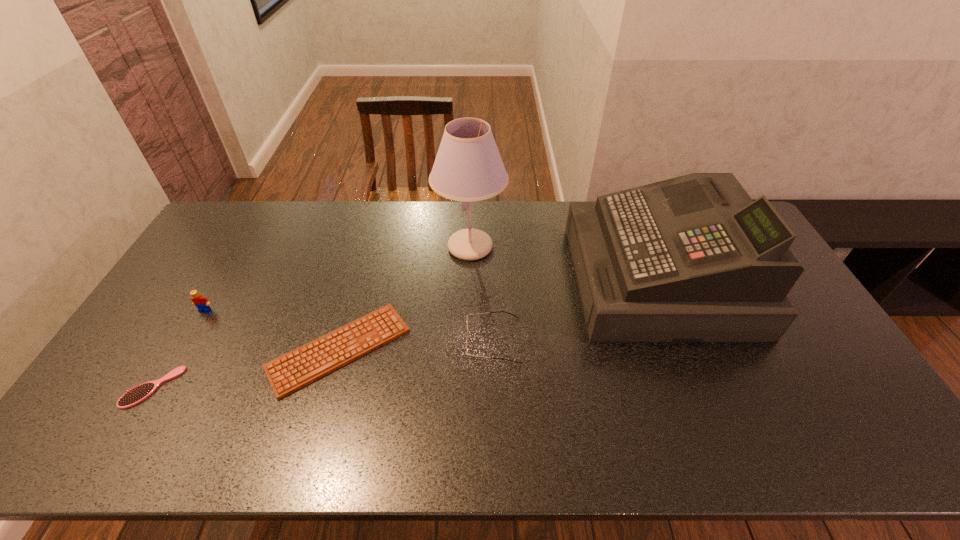
Where is `lampshade`? The height and width of the screenshot is (540, 960). lampshade is located at coordinates (468, 167).

Where is `cash register`? cash register is located at coordinates (690, 259).

At what (x,y) coordinates should I click in order to perform the action: click on the fifth shortest object. Please return your answer as a coordinate pair (x, y). The width and height of the screenshot is (960, 540). Looking at the image, I should click on (690, 259).

You are a GUI agent. You are given a task and a screenshot of the screen. Output one action in this format:
    pyautogui.click(x=<x>, y=<y>)
    Task: Click on the third tallest object
    This screenshot has height=540, width=960.
    Given the screenshot: What is the action you would take?
    pyautogui.click(x=202, y=304)

The image size is (960, 540). I want to click on the third shortest object, so click(x=498, y=311).

Locate an element on the screen. hairbrush is located at coordinates (134, 396).

The image size is (960, 540). In order to click on the shortest object in this screenshot , I will do [294, 370].

Find the location of a particular element. computer keyboard is located at coordinates (294, 370).

This screenshot has width=960, height=540. Find the location of `free space located 0.330m on the left of the tallest object`. free space located 0.330m on the left of the tallest object is located at coordinates (340, 247).

Find the location of a particular element. This screenshot has height=540, width=960. blank area located on the front-facing side of the fifth shortest object is located at coordinates (480, 279).